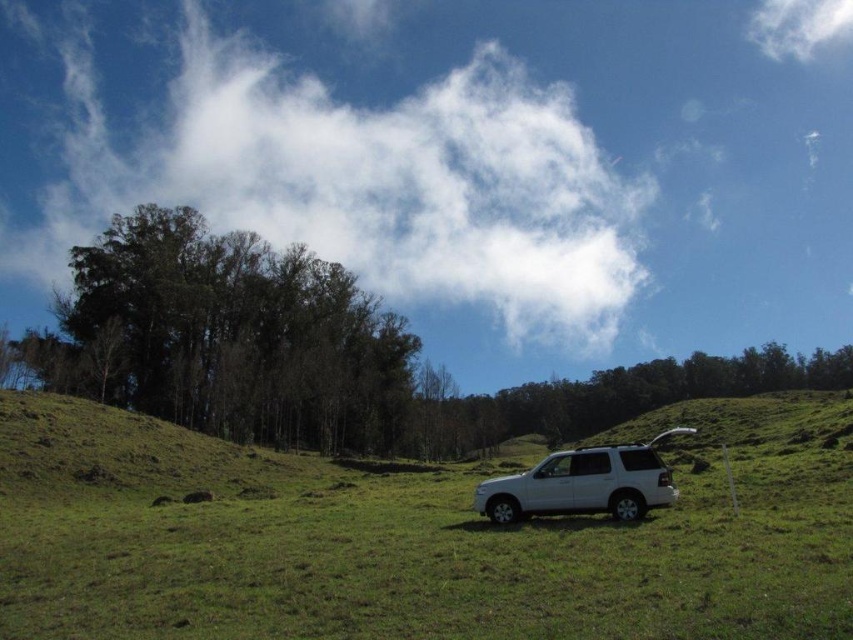
How much distance is there between green grassy field at center and white matte suv at center?

green grassy field at center and white matte suv at center are 60.47 feet apart from each other.

Who is more forward, [775,477] or [534,506]?

Point [534,506] is more forward.

I want to click on green grassy field at center, so click(412, 538).

Who is taller, white fluffy cloud at upper center or white matte suv at center?

With more height is white fluffy cloud at upper center.

Between white fluffy cloud at upper center and white matte suv at center, which one has less height?

Standing shorter between the two is white matte suv at center.

Does point (200, 13) come behind point (657, 461)?

Yes, it is.

You are a GUI agent. You are given a task and a screenshot of the screen. Output one action in this format:
    pyautogui.click(x=<x>, y=<y>)
    Task: Click on the white fluffy cloud at upper center
    The width and height of the screenshot is (853, 640).
    Given the screenshot: What is the action you would take?
    tap(363, 180)

Between green grassy field at center and white fluffy cloud at upper center, which one appears on the left side from the viewer's perspective?

white fluffy cloud at upper center is more to the left.

Which is in front, point (712, 550) or point (549, 148)?

Positioned in front is point (712, 550).

Who is more forward, (198, 577) or (83, 161)?

Point (198, 577)

Where is `green grassy field at center`? This screenshot has height=640, width=853. green grassy field at center is located at coordinates (x=412, y=538).